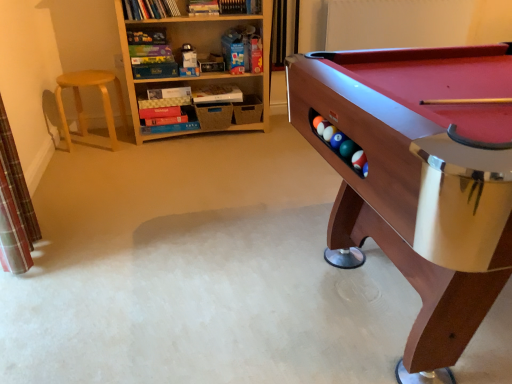
At what (x,y) coordinates should I click in order to perform the action: click on wooden pool table at right. Please return your answer as a coordinate pair (x, y). Looking at the image, I should click on (420, 176).

Does point (333, 163) lie in front of point (113, 77)?

Yes, it is.

Considering the sizes of wooden pool table at right and light brown wooden stool at left in the image, is wooden pool table at right wider or thinner than light brown wooden stool at left?

Clearly, wooden pool table at right has more width compared to light brown wooden stool at left.

Is wooden pool table at right further to the viewer compared to light brown wooden stool at left?

That is False.

Does wooden pool table at right turn towards light brown wooden stool at left?

No, wooden pool table at right is not oriented towards light brown wooden stool at left.

Relative to wooden pool table at right, is light brown wooden stool at left in front or behind?

light brown wooden stool at left is behind wooden pool table at right.

Is wooden pool table at right surrounded by light brown wooden stool at left?

No, light brown wooden stool at left does not contain wooden pool table at right.

In terms of size, does light brown wooden stool at left appear bigger or smaller than wooden pool table at right?

Considering their sizes, light brown wooden stool at left takes up less space than wooden pool table at right.

Is light brown wooden stool at left oriented towards wooden pool table at right?

No, light brown wooden stool at left is not turned towards wooden pool table at right.

Considering the sizes of objects light brown wooden stool at left and wooden bookshelf at upper left in the image provided, who is taller, light brown wooden stool at left or wooden bookshelf at upper left?

With more height is wooden bookshelf at upper left.

Is light brown wooden stool at left further to the viewer compared to wooden bookshelf at upper left?

That is True.

What's the angular difference between light brown wooden stool at left and wooden bookshelf at upper left's facing directions?

There is a 0.928-degree angle between the facing directions of light brown wooden stool at left and wooden bookshelf at upper left.

Would you say wooden pool table at right is outside wooden bookshelf at upper left?

Yes.

From the image's perspective, between wooden pool table at right and wooden bookshelf at upper left, who is located below?

wooden pool table at right appears lower in the image.

How many degrees apart are the facing directions of wooden pool table at right and wooden bookshelf at upper left?

The angle between the facing direction of wooden pool table at right and the facing direction of wooden bookshelf at upper left is 1.17 degrees.

Does wooden pool table at right touch wooden bookshelf at upper left?

No.

What's the angular difference between wooden bookshelf at upper left and light brown wooden stool at left's facing directions?

The angle between the facing direction of wooden bookshelf at upper left and the facing direction of light brown wooden stool at left is 0.928 degrees.

Looking at their sizes, would you say wooden bookshelf at upper left is wider or thinner than light brown wooden stool at left?

Considering their sizes, wooden bookshelf at upper left looks slimmer than light brown wooden stool at left.

Find the location of a particular element. The width and height of the screenshot is (512, 384). stool that appears below the wooden bookshelf at upper left (from the image's perspective) is located at coordinates (83, 109).

From the image's perspective, is wooden bookshelf at upper left below wooden pool table at right?

No, from the image's perspective, wooden bookshelf at upper left is not below wooden pool table at right.

From a real-world perspective, does wooden bookshelf at upper left stand above wooden pool table at right?

Yes, from a real-world perspective, wooden bookshelf at upper left is over wooden pool table at right

Looking at this image, is wooden bookshelf at upper left far away from wooden pool table at right?

Yes, wooden bookshelf at upper left and wooden pool table at right are located far from each other.

How different are the orientations of wooden bookshelf at upper left and wooden pool table at right in degrees?

There is a 1.17-degree angle between the facing directions of wooden bookshelf at upper left and wooden pool table at right.

I want to click on table below the light brown wooden stool at left (from the image's perspective), so click(x=420, y=176).

Find the location of a particular element. table that is above the light brown wooden stool at left (from a real-world perspective) is located at coordinates (420, 176).

When comparing their distances from wooden bookshelf at upper left, does wooden pool table at right or light brown wooden stool at left seem further?

wooden pool table at right lies further to wooden bookshelf at upper left than the other object.

Estimate the real-world distances between objects in this image. Which object is closer to light brown wooden stool at left, wooden pool table at right or wooden bookshelf at upper left?

Based on the image, wooden bookshelf at upper left appears to be nearer to light brown wooden stool at left.

Considering their positions, is light brown wooden stool at left positioned further to wooden pool table at right than wooden bookshelf at upper left?

Based on the image, light brown wooden stool at left appears to be further to wooden pool table at right.

Looking at the image, which one is located further to light brown wooden stool at left, wooden bookshelf at upper left or wooden pool table at right?

Based on the image, wooden pool table at right appears to be further to light brown wooden stool at left.

Which object lies nearer to the anchor point wooden bookshelf at upper left, light brown wooden stool at left or wooden pool table at right?

light brown wooden stool at left is positioned closer to the anchor wooden bookshelf at upper left.

Considering their positions, is wooden bookshelf at upper left positioned closer to wooden pool table at right than light brown wooden stool at left?

wooden bookshelf at upper left lies closer to wooden pool table at right than the other object.

Where is `bookcase between wooden pool table at right and light brown wooden stool at left in the front-back direction`? This screenshot has width=512, height=384. bookcase between wooden pool table at right and light brown wooden stool at left in the front-back direction is located at coordinates (202, 52).